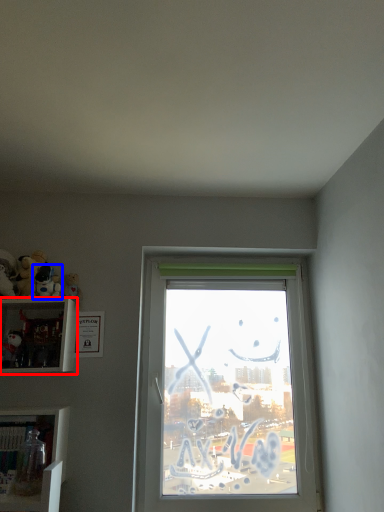
Question: Which object appears farthest to the camera in this image, shelf (highlighted by a red box) or toy (highlighted by a blue box)?

Choices:
 (A) shelf
 (B) toy

Answer: (B)